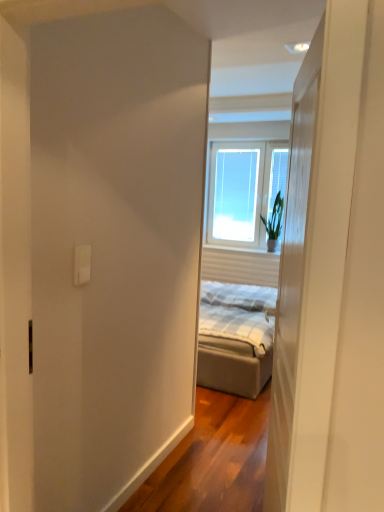
Question: Is the depth of clear glass window at center, the second window when ordered from left to right, less than that of green leafy plant at window?

Choices:
 (A) no
 (B) yes

Answer: (A)

Question: From a real-world perspective, is clear glass window at center, the 1th window in the right-to-left sequence, on top of green leafy plant at window?

Choices:
 (A) no
 (B) yes

Answer: (B)

Question: Is clear glass window at center, the second window when ordered from left to right, further to the viewer compared to green leafy plant at window?

Choices:
 (A) no
 (B) yes

Answer: (B)

Question: Considering the relative sizes of clear glass window at center, the 1th window in the right-to-left sequence, and green leafy plant at window in the image provided, is clear glass window at center, the 1th window in the right-to-left sequence, shorter than green leafy plant at window?

Choices:
 (A) yes
 (B) no

Answer: (B)

Question: Considering the relative sizes of clear glass window at center, the second window when ordered from left to right, and green leafy plant at window in the image provided, is clear glass window at center, the second window when ordered from left to right, bigger than green leafy plant at window?

Choices:
 (A) no
 (B) yes

Answer: (B)

Question: In the image, is clear glass window at center, the 1th window in the right-to-left sequence, positioned in front of or behind white plastic outlet at upper left?

Choices:
 (A) behind
 (B) front

Answer: (A)

Question: Is clear glass window at center, the second window when ordered from left to right, situated inside white plastic outlet at upper left or outside?

Choices:
 (A) inside
 (B) outside

Answer: (B)

Question: From a real-world perspective, is clear glass window at center, the second window when ordered from left to right, above or below white plastic outlet at upper left?

Choices:
 (A) below
 (B) above

Answer: (B)

Question: Considering the positions of clear glass window at center, the 1th window in the right-to-left sequence, and white plastic outlet at upper left in the image, is clear glass window at center, the 1th window in the right-to-left sequence, taller or shorter than white plastic outlet at upper left?

Choices:
 (A) tall
 (B) short

Answer: (A)

Question: Looking at their shapes, would you say green leafy plant at window is wider or thinner than white wood door at center?

Choices:
 (A) wide
 (B) thin

Answer: (A)

Question: Is green leafy plant at window to the left or to the right of white wood door at center in the image?

Choices:
 (A) right
 (B) left

Answer: (A)

Question: From a real-world perspective, is green leafy plant at window above or below white wood door at center?

Choices:
 (A) below
 (B) above

Answer: (B)

Question: In the image, is green leafy plant at window positioned in front of or behind white wood door at center?

Choices:
 (A) behind
 (B) front

Answer: (A)

Question: Would you say transparent glass window at center, which is the first window in left-to-right order, is to the left or to the right of clear glass window at center, the 1th window in the right-to-left sequence, in the picture?

Choices:
 (A) left
 (B) right

Answer: (A)

Question: From the image's perspective, relative to clear glass window at center, the 1th window in the right-to-left sequence, is transparent glass window at center, the second window viewed from the right, above or below?

Choices:
 (A) above
 (B) below

Answer: (A)